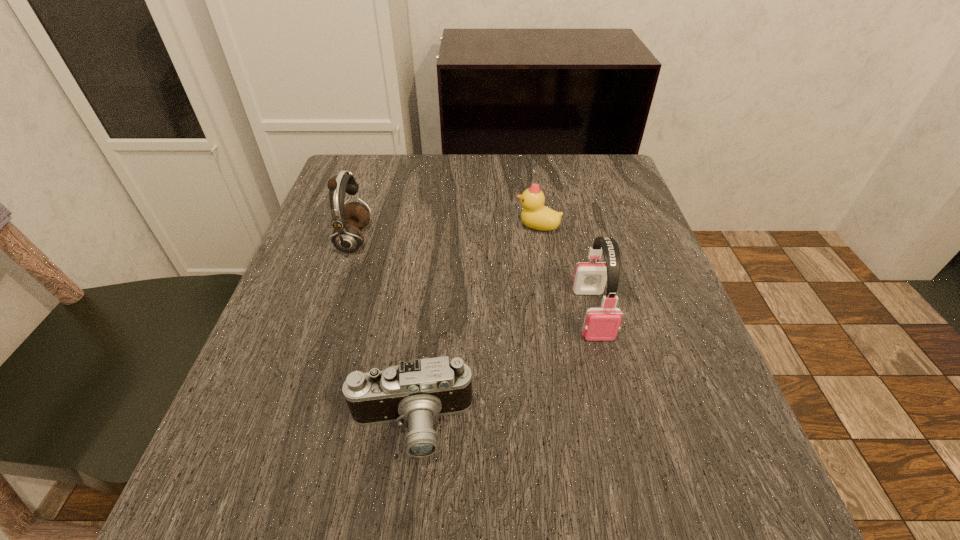
You are a GUI agent. You are given a task and a screenshot of the screen. Output one action in this format:
    pyautogui.click(x=<x>, y=<y>)
    Task: Click on the farther earphone
    This screenshot has width=960, height=540.
    Given the screenshot: What is the action you would take?
    pyautogui.click(x=347, y=220)

Locate an element on the screen. the leftmost object is located at coordinates (347, 220).

Locate an element on the screen. This screenshot has height=540, width=960. the nearer earphone is located at coordinates (601, 324).

What are the coordinates of `the right earphone` in the screenshot? It's located at (601, 324).

Where is `duckling`? duckling is located at coordinates (535, 215).

Identify the location of the nearest object. This screenshot has height=540, width=960. (417, 391).

Identify the location of the second object from left to right. (417, 391).

Find the location of a particular element. free space located 0.400m on the ear pads of the leftmost object is located at coordinates [x=556, y=240].

The image size is (960, 540). In order to click on vacant space located 0.290m on the outer surface of the nearer earphone in this screenshot , I will do `click(645, 531)`.

Where is `free point located 0.240m on the front-facing side of the duckling`? The height and width of the screenshot is (540, 960). free point located 0.240m on the front-facing side of the duckling is located at coordinates (408, 227).